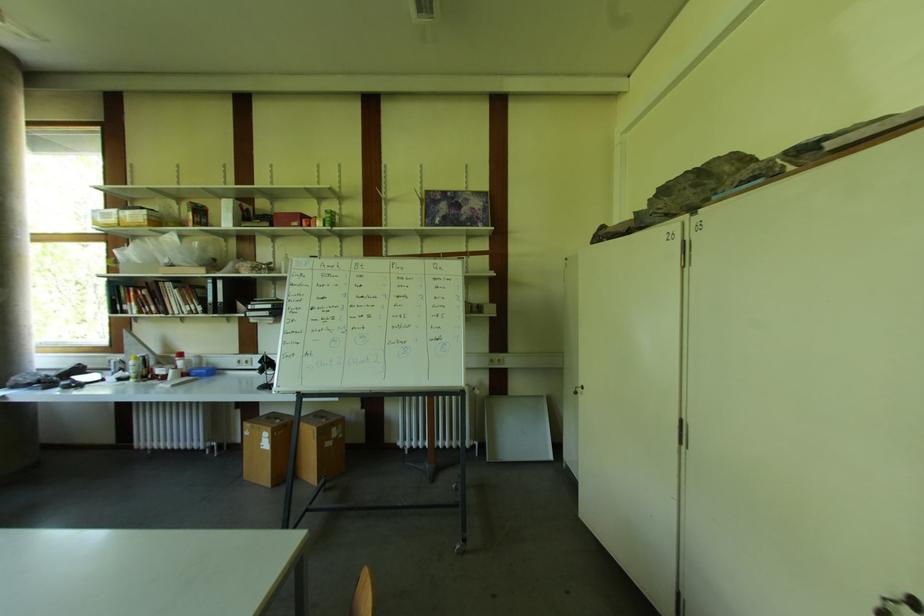
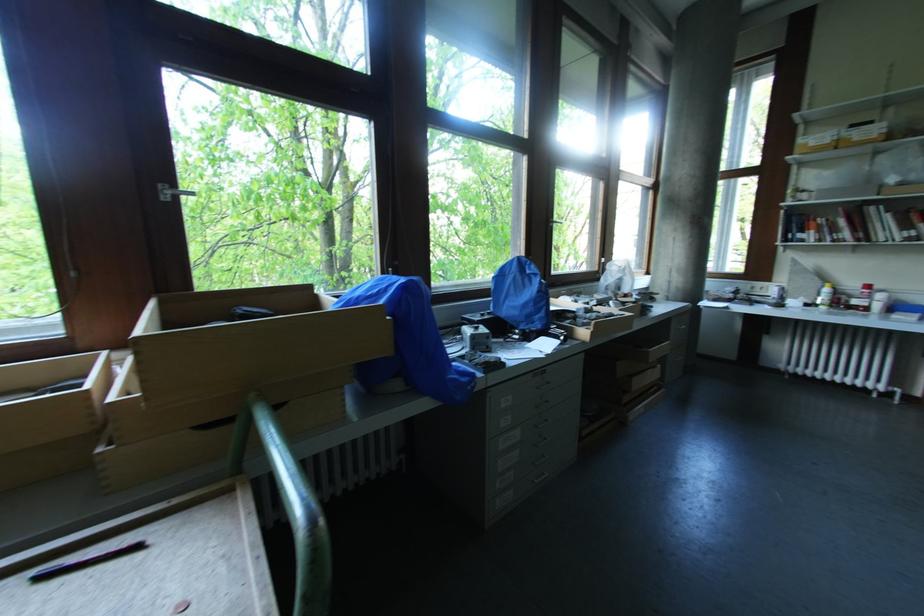
The point at (184, 365) is marked in the first image. Where is the corresponding point in the second image?

(882, 298)